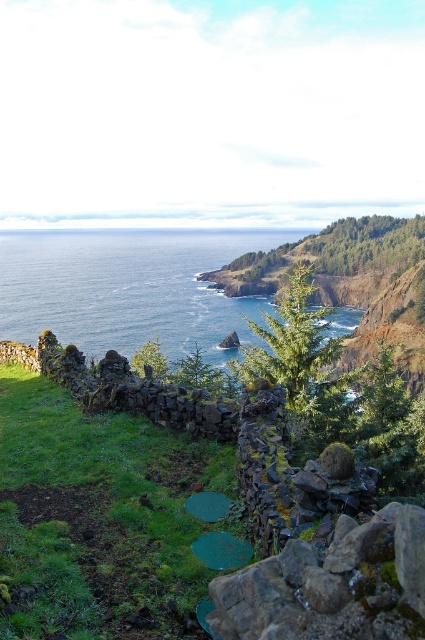
Who is positioned more to the left, green grass at lower left or blue water at center?

blue water at center

Consider the image. Does green grass at lower left have a greater height compared to blue water at center?

No.

You are a GUI agent. You are given a task and a screenshot of the screen. Output one action in this format:
    pyautogui.click(x=<x>, y=<y>)
    Task: Click on the green grass at lower left
    
    Given the screenshot: What is the action you would take?
    pyautogui.click(x=99, y=518)